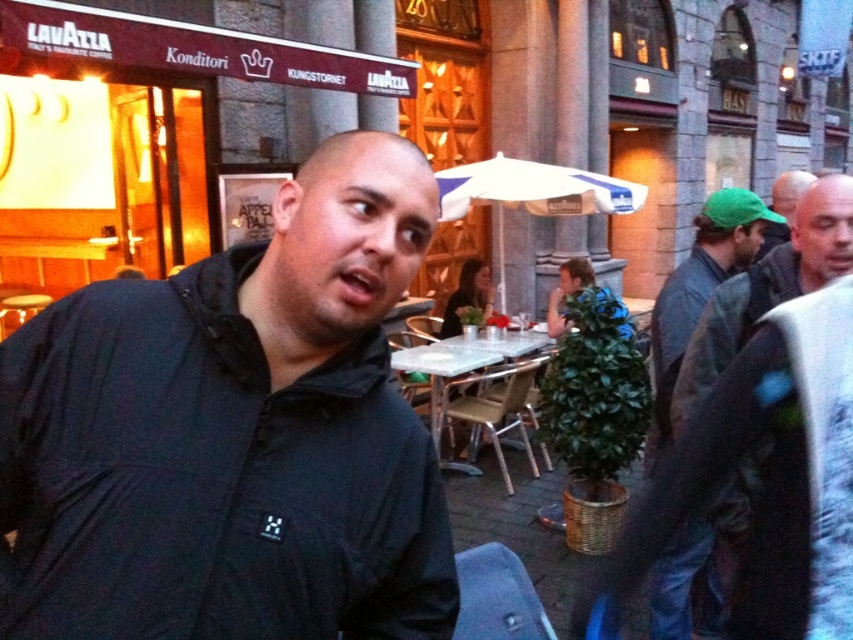
Between black matte jacket at center and green fabric jacket at right, which one is positioned lower?

black matte jacket at center is lower down.

Between black matte jacket at center and green fabric jacket at right, which one appears on the right side from the viewer's perspective?

green fabric jacket at right

The image size is (853, 640). Find the location of `black matte jacket at center`. black matte jacket at center is located at coordinates (233, 435).

Does green fabric jacket at right have a greater height compared to white fabric umbrella at center?

Indeed, green fabric jacket at right has a greater height compared to white fabric umbrella at center.

Describe the element at coordinates (699, 291) in the screenshot. The width and height of the screenshot is (853, 640). I see `green fabric jacket at right` at that location.

Which is behind, point (752, 211) or point (543, 189)?

Positioned behind is point (543, 189).

Where is `green fabric jacket at right`? The width and height of the screenshot is (853, 640). green fabric jacket at right is located at coordinates (699, 291).

Who is taller, green fabric cap at upper right or white fabric umbrella at center?

green fabric cap at upper right

Find the location of a particular element. The width and height of the screenshot is (853, 640). green fabric cap at upper right is located at coordinates (764, 468).

What are the coordinates of `green fabric cap at upper right` in the screenshot? It's located at (764, 468).

Where is `green fabric cap at upper right`? This screenshot has height=640, width=853. green fabric cap at upper right is located at coordinates (764, 468).